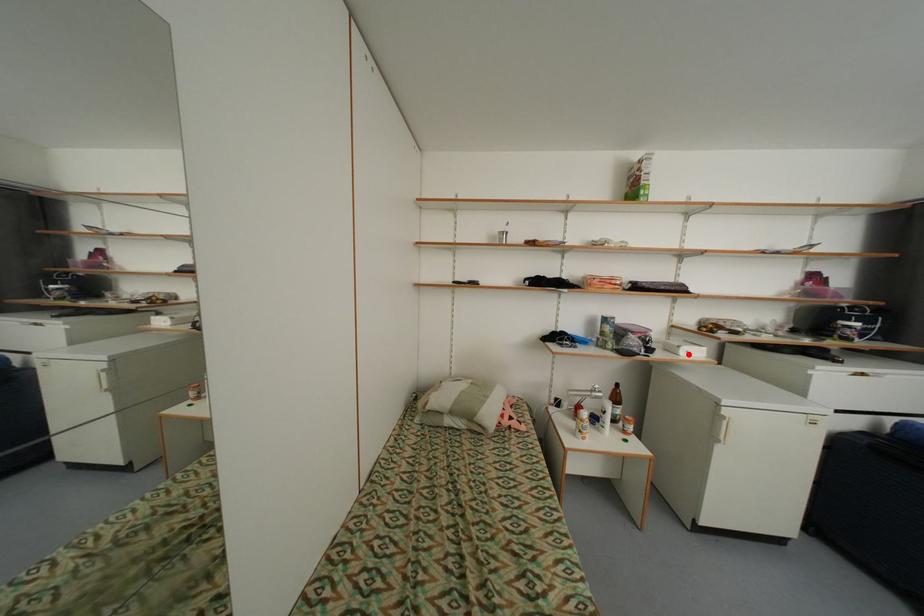
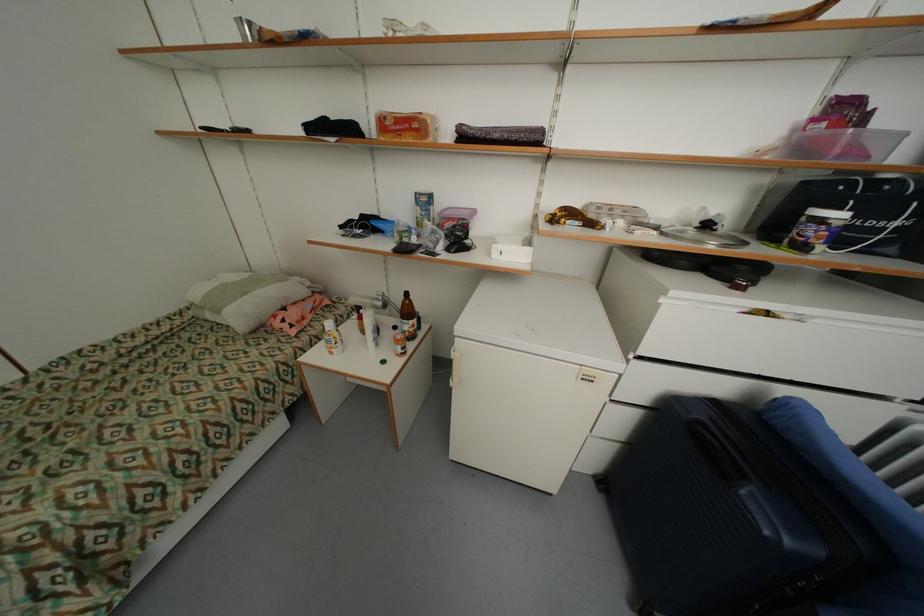
Where in the second image is the point corresponding to the highlighted location from the first image?

(502, 256)